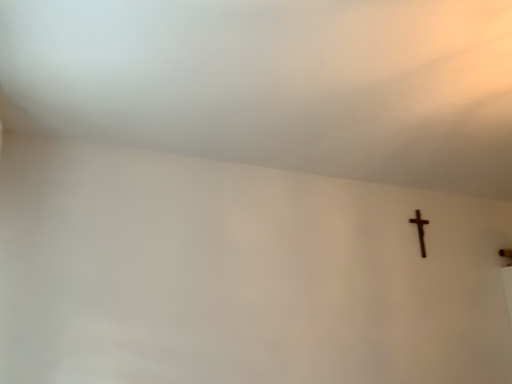
Where is `rustic wood cross at right`? Image resolution: width=512 pixels, height=384 pixels. rustic wood cross at right is located at coordinates (420, 230).

What do you see at coordinates (420, 230) in the screenshot? I see `rustic wood cross at right` at bounding box center [420, 230].

In order to face rustic wood cross at right, should I rotate leftwards or rightwards?

You should look right and rotate roughly 21.595 degrees.

The height and width of the screenshot is (384, 512). What are the coordinates of `rustic wood cross at right` in the screenshot? It's located at (420, 230).